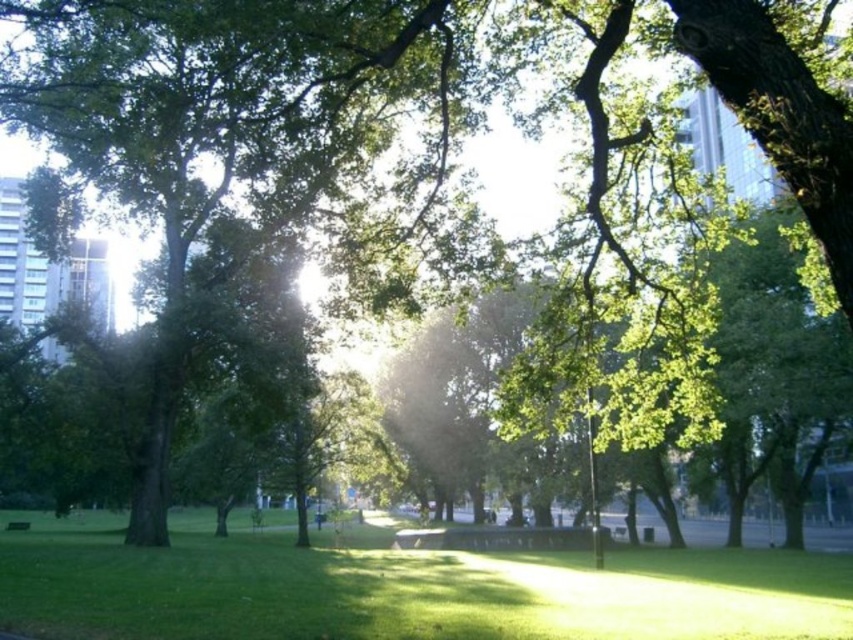
Question: Is the position of green grassy at center more distant than that of green wooden bench at center?

Choices:
 (A) yes
 (B) no

Answer: (B)

Question: Which of the following is the closest to the observer?

Choices:
 (A) (288, 532)
 (B) (22, 522)

Answer: (B)

Question: Which of the following is the closest to the observer?

Choices:
 (A) (223, 596)
 (B) (25, 529)

Answer: (A)

Question: Which of the following is the farthest from the observer?

Choices:
 (A) green grassy at center
 (B) green wooden bench at center

Answer: (B)

Question: Where is green grassy at center located in relation to green wooden bench at center in the image?

Choices:
 (A) right
 (B) left

Answer: (A)

Question: Can you confirm if green grassy at center is positioned above green wooden bench at center?

Choices:
 (A) yes
 (B) no

Answer: (A)